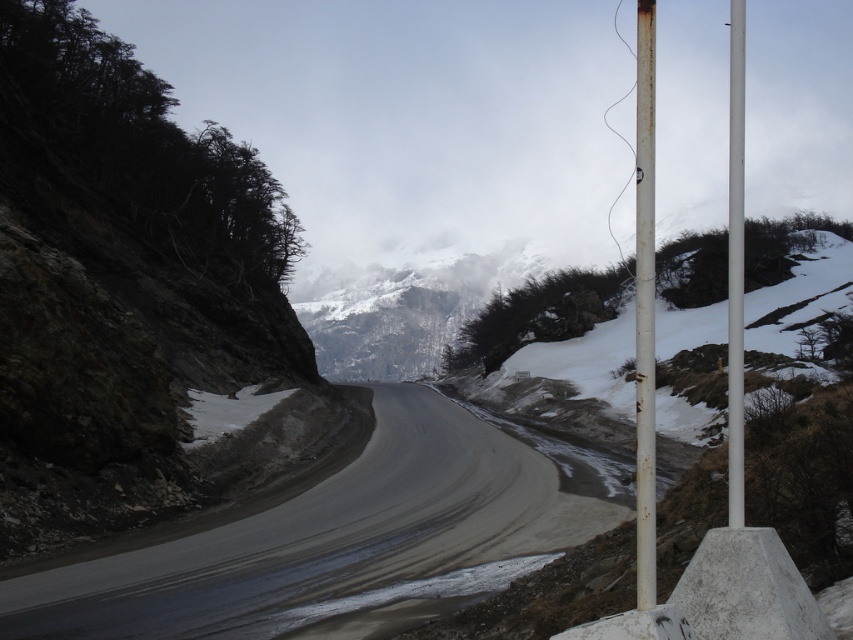
Question: Which object appears farthest from the camera in this image?

Choices:
 (A) smooth asphalt road at center
 (B) rusty metal pole at center-right

Answer: (A)

Question: Is rusty metal pole at right above rusty metal pole at center-right?

Choices:
 (A) no
 (B) yes

Answer: (B)

Question: Which object appears farthest from the camera in this image?

Choices:
 (A) rusty metal pole at right
 (B) smooth asphalt road at center

Answer: (B)

Question: Is smooth asphalt road at center positioned at the back of rusty metal pole at right?

Choices:
 (A) yes
 (B) no

Answer: (A)

Question: Where is smooth asphalt road at center located in relation to rusty metal pole at center-right in the image?

Choices:
 (A) left
 (B) right

Answer: (A)

Question: Which of these objects is positioned farthest from the smooth asphalt road at center?

Choices:
 (A) rusty metal pole at right
 (B) rusty metal pole at center-right

Answer: (B)